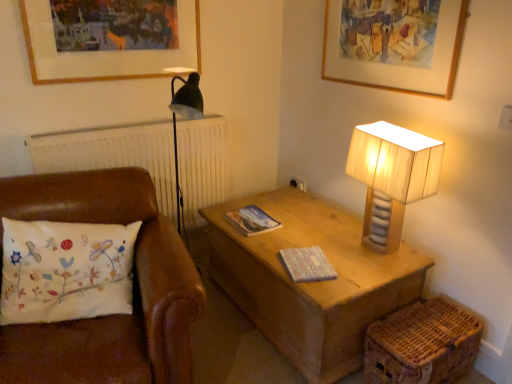
Question: In which direction should I rotate to look at matte paper magazine at center, which ranks as the second magazine in bottom-to-top order?

Choices:
 (A) left
 (B) right

Answer: (A)

Question: Does wooden picture frame at upper center, marked as the first picture frame in a right-to-left arrangement, have a lesser height compared to white embroidered pillow at left?

Choices:
 (A) no
 (B) yes

Answer: (B)

Question: Can you confirm if wooden picture frame at upper center, the second picture frame positioned from the left, is positioned to the right of white embroidered pillow at left?

Choices:
 (A) yes
 (B) no

Answer: (A)

Question: Considering the relative sizes of wooden picture frame at upper center, marked as the first picture frame in a right-to-left arrangement, and white embroidered pillow at left in the image provided, is wooden picture frame at upper center, marked as the first picture frame in a right-to-left arrangement, taller than white embroidered pillow at left?

Choices:
 (A) yes
 (B) no

Answer: (B)

Question: Is wooden picture frame at upper center, marked as the first picture frame in a right-to-left arrangement, positioned before white embroidered pillow at left?

Choices:
 (A) yes
 (B) no

Answer: (B)

Question: Is wooden picture frame at upper center, the second picture frame positioned from the left, bigger than white embroidered pillow at left?

Choices:
 (A) no
 (B) yes

Answer: (A)

Question: Is the position of wooden picture frame at upper center, marked as the first picture frame in a right-to-left arrangement, more distant than that of white embroidered pillow at left?

Choices:
 (A) yes
 (B) no

Answer: (A)

Question: From a real-world perspective, is wooden textured book at center, arranged as the first magazine when viewed from the right, on woven brown basket at lower right?

Choices:
 (A) yes
 (B) no

Answer: (A)

Question: Is wooden textured book at center, arranged as the first magazine when viewed from the right, smaller than woven brown basket at lower right?

Choices:
 (A) yes
 (B) no

Answer: (A)

Question: Is wooden textured book at center, placed as the first magazine when sorted from bottom to top, further to camera compared to woven brown basket at lower right?

Choices:
 (A) yes
 (B) no

Answer: (A)

Question: Could you tell me if wooden textured book at center, the second magazine positioned from the top, is turned towards woven brown basket at lower right?

Choices:
 (A) no
 (B) yes

Answer: (A)

Question: Is the depth of wooden textured book at center, placed as the first magazine when sorted from bottom to top, less than that of woven brown basket at lower right?

Choices:
 (A) yes
 (B) no

Answer: (B)

Question: Would you say wooden textured book at center, the second magazine positioned from the top, is outside woven brown basket at lower right?

Choices:
 (A) yes
 (B) no

Answer: (A)

Question: Is wooden lampshade at right at the left side of wooden textured book at center, the second magazine positioned from the top?

Choices:
 (A) yes
 (B) no

Answer: (B)